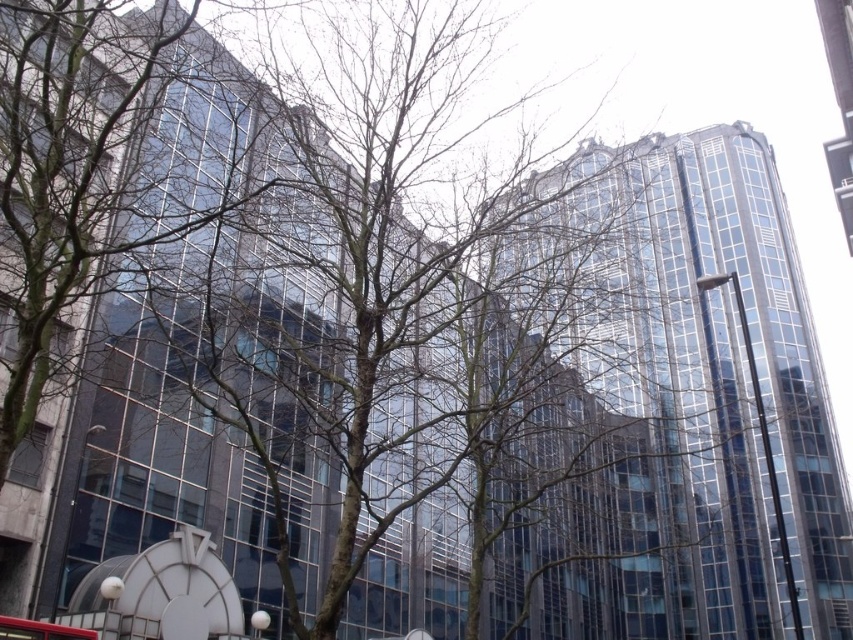
Who is positioned more to the right, white glossy clock at lower left or red rubber bus at center?

white glossy clock at lower left is more to the right.

Can you confirm if white glossy clock at lower left is positioned to the left of red rubber bus at center?

No, white glossy clock at lower left is not to the left of red rubber bus at center.

Who is more forward, (193, 632) or (28, 625)?

Point (28, 625) is in front.

The height and width of the screenshot is (640, 853). Identify the location of white glossy clock at lower left. (178, 589).